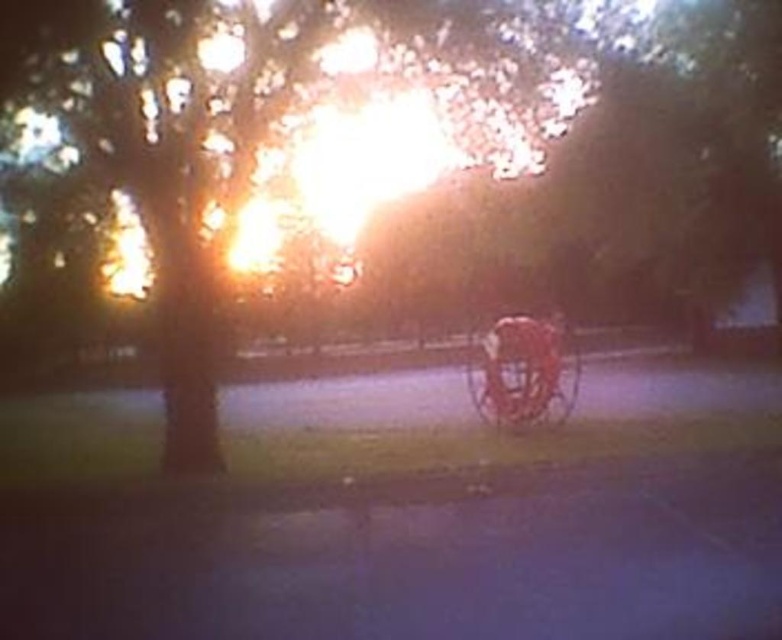
Does green matte tree at center appear on the left side of metallic gold horse cart at center?

Indeed, green matte tree at center is positioned on the left side of metallic gold horse cart at center.

The height and width of the screenshot is (640, 782). Describe the element at coordinates (388, 182) in the screenshot. I see `green matte tree at center` at that location.

Where is `green matte tree at center`? The height and width of the screenshot is (640, 782). green matte tree at center is located at coordinates (388, 182).